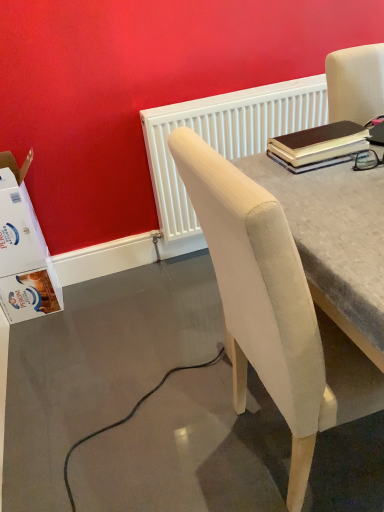
Question: Looking at their shapes, would you say brown leather notebook at upper right is wider or thinner than beige fabric chair at upper right?

Choices:
 (A) thin
 (B) wide

Answer: (A)

Question: From their relative heights in the image, would you say brown leather notebook at upper right is taller or shorter than beige fabric chair at upper right?

Choices:
 (A) tall
 (B) short

Answer: (B)

Question: Which is farther from the white textured radiator at upper center?

Choices:
 (A) brown leather notebook at upper right
 (B) beige fabric chair at upper right
 (C) white cardboard box at lower left

Answer: (B)

Question: Which object is positioned farthest from the brown leather notebook at upper right?

Choices:
 (A) white cardboard box at lower left
 (B) white textured radiator at upper center
 (C) beige fabric chair at upper right

Answer: (A)